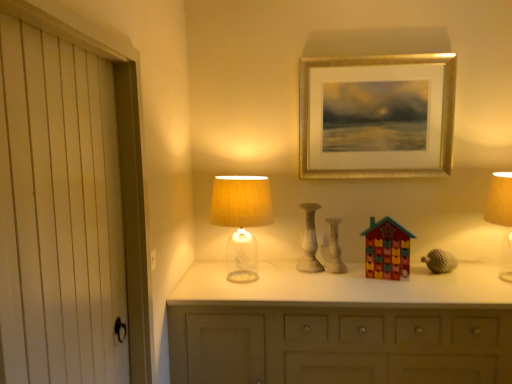
Question: Considering the relative sizes of multicolored plastic advent calendar at center, acting as the first toy starting from the front, and white marble candle holder at center in the image provided, is multicolored plastic advent calendar at center, acting as the first toy starting from the front, smaller than white marble candle holder at center?

Choices:
 (A) yes
 (B) no

Answer: (A)

Question: Is white marble candle holder at center inside multicolored plastic advent calendar at center, positioned as the 2th toy in left-to-right order?

Choices:
 (A) no
 (B) yes

Answer: (A)

Question: Does multicolored plastic advent calendar at center, acting as the first toy starting from the front, appear on the left side of white marble candle holder at center?

Choices:
 (A) yes
 (B) no

Answer: (B)

Question: Can you confirm if multicolored plastic advent calendar at center, which ranks as the 2th toy in back-to-front order, is thinner than white marble candle holder at center?

Choices:
 (A) yes
 (B) no

Answer: (A)

Question: From a real-world perspective, is multicolored plastic advent calendar at center, acting as the first toy starting from the front, over white marble candle holder at center?

Choices:
 (A) yes
 (B) no

Answer: (B)

Question: Is the depth of multicolored plastic advent calendar at center, positioned as the 2th toy in left-to-right order, less than that of white marble candle holder at center?

Choices:
 (A) no
 (B) yes

Answer: (B)

Question: Considering the relative sizes of translucent glass lampshade at center, which is counted as the second table lamp, starting from the right, and matte gray acorn at right in the image provided, is translucent glass lampshade at center, which is counted as the second table lamp, starting from the right, shorter than matte gray acorn at right?

Choices:
 (A) no
 (B) yes

Answer: (A)

Question: Is translucent glass lampshade at center, which is counted as the second table lamp, starting from the right, touching matte gray acorn at right?

Choices:
 (A) yes
 (B) no

Answer: (B)

Question: Is translucent glass lampshade at center, which is counted as the second table lamp, starting from the right, outside matte gray acorn at right?

Choices:
 (A) yes
 (B) no

Answer: (A)

Question: From a real-world perspective, is translucent glass lampshade at center, which is counted as the second table lamp, starting from the right, beneath matte gray acorn at right?

Choices:
 (A) yes
 (B) no

Answer: (B)

Question: Considering the relative sizes of translucent glass lampshade at center, which is counted as the second table lamp, starting from the right, and matte gray acorn at right in the image provided, is translucent glass lampshade at center, which is counted as the second table lamp, starting from the right, bigger than matte gray acorn at right?

Choices:
 (A) no
 (B) yes

Answer: (B)

Question: Can you confirm if translucent glass lampshade at center, which is the 1th table lamp in left-to-right order, is thinner than matte gray acorn at right?

Choices:
 (A) no
 (B) yes

Answer: (A)

Question: Can you confirm if matte gray acorn at right is thinner than matte ceramic house at center, which ranks as the second toy in right-to-left order?

Choices:
 (A) yes
 (B) no

Answer: (B)